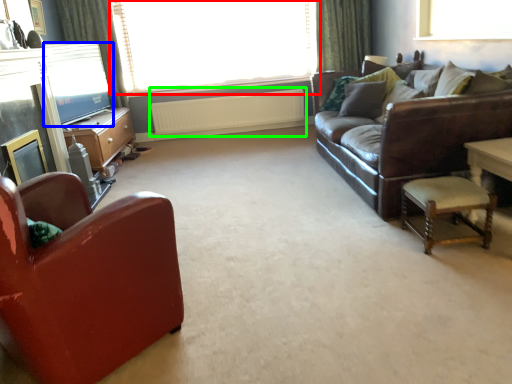
Question: Which is nearer to the window (highlighted by a red box)? window screen (highlighted by a blue box) or radiator (highlighted by a green box).

Choices:
 (A) window screen
 (B) radiator

Answer: (B)